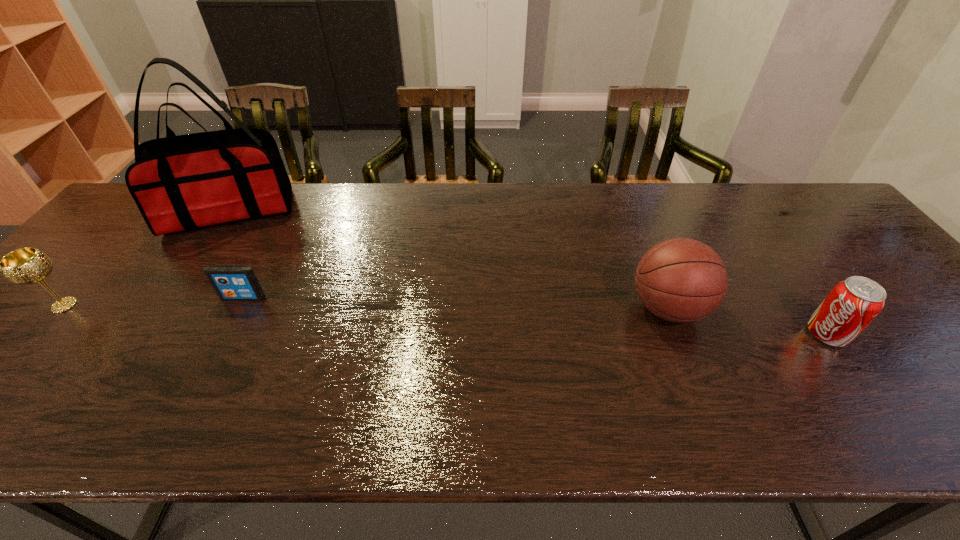
Identify which object is the nearest to the iPod. Please provide its 2D coordinates. Your answer should be formatted as a tuple, i.e. [(x, y)], where the tuple contains the x and y coordinates of a point satisfying the conditions above.

[(179, 183)]

The height and width of the screenshot is (540, 960). I want to click on the fourth closest object to the fourth shortest object, so click(x=24, y=266).

Identify the location of vacant region that satisfies the following two spatial constraints: 1. on the front side of the chalice; 2. on the left side of the rightmost object. (39, 334).

The height and width of the screenshot is (540, 960). I want to click on vacant space that satisfies the following two spatial constraints: 1. on the back side of the leftmost object; 2. on the left side of the duffel bag, so click(x=147, y=212).

In order to click on vacant point that satisfies the following two spatial constraints: 1. on the front side of the soda; 2. on the right side of the duffel bag in this screenshot , I will do `click(149, 334)`.